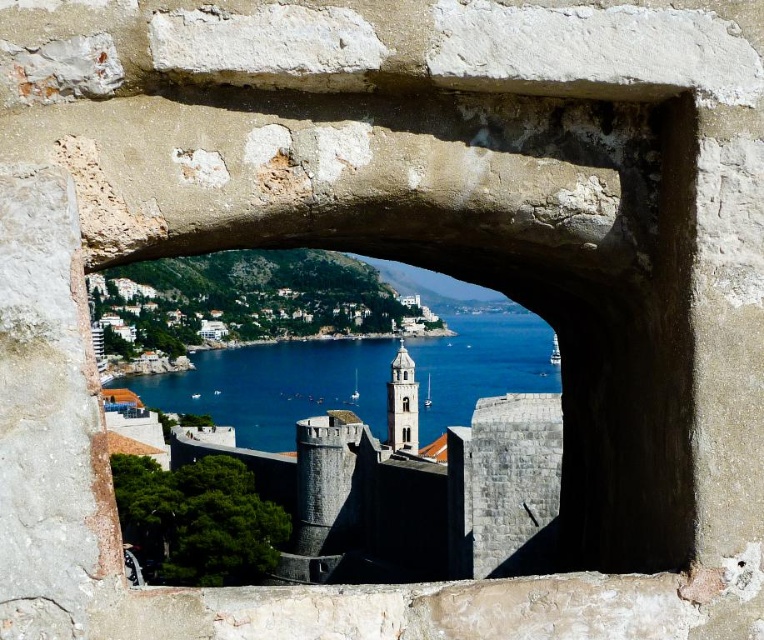
You are an architect examining this historical site. You notice the blue water at center and the white stone tower at center. Which of these two objects appears larger in height within the image?

The blue water at center appears much taller than the white stone tower at center in the image.

You are an architect designing a new window for a building. You want to ensure that the view of the blue water at center is wider than the clear glass window at center. Is this possible based on the current scene?

The blue water at center might be wider than the clear glass window at center, so it is possible that the view of the blue water at center could be wider than the clear glass window at center in the current scene.

You are an architect designing a new observation deck. You want to ensure visitors can see both the blue water at center and the clear glass window at center. Based on their sizes, which one would appear larger in the view?

The blue water at center would appear larger in the view because it is much taller than the clear glass window at center.